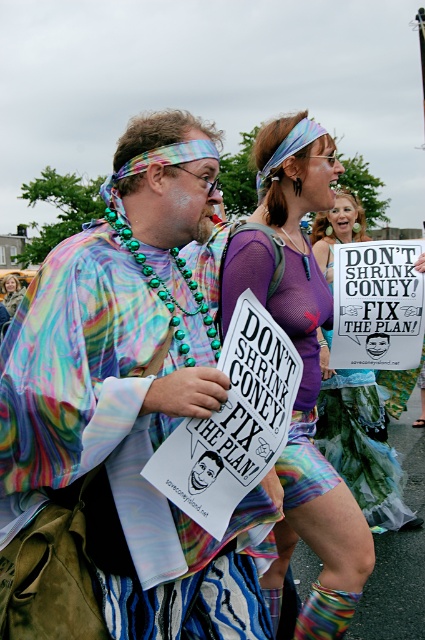
Question: Among these points, which one is farthest from the camera?

Choices:
 (A) (244, 269)
 (B) (130, 442)
 (C) (317, 442)
 (D) (13, 273)

Answer: (D)

Question: Among these points, which one is farthest from the camera?

Choices:
 (A) (402, 474)
 (B) (10, 280)

Answer: (B)

Question: Considering the relative positions of rainbow tie-dye shirt at center and multicolored fabric skirt at center in the image provided, where is rainbow tie-dye shirt at center located with respect to multicolored fabric skirt at center?

Choices:
 (A) above
 (B) below

Answer: (A)

Question: Is matte purple mesh top at center closer to the viewer compared to rainbow fabric scarf at upper left?

Choices:
 (A) yes
 (B) no

Answer: (A)

Question: Is rainbow tie-dye shirt at center to the right of rainbow fabric scarf at upper left from the viewer's perspective?

Choices:
 (A) yes
 (B) no

Answer: (A)

Question: Which point is closer to the camera?

Choices:
 (A) (6, 291)
 (B) (373, 426)
 (C) (260, 147)
 (D) (150, 448)

Answer: (D)